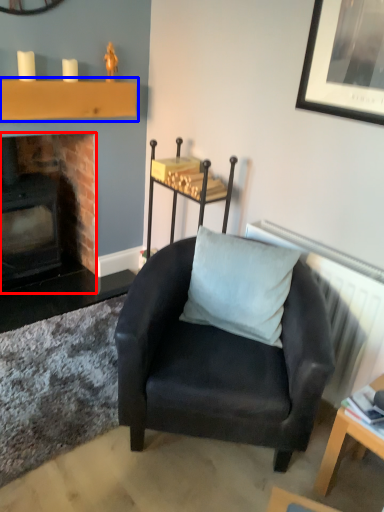
Question: Among these objects, which one is farthest to the camera, fireplace (highlighted by a red box) or shelf (highlighted by a blue box)?

Choices:
 (A) fireplace
 (B) shelf

Answer: (A)